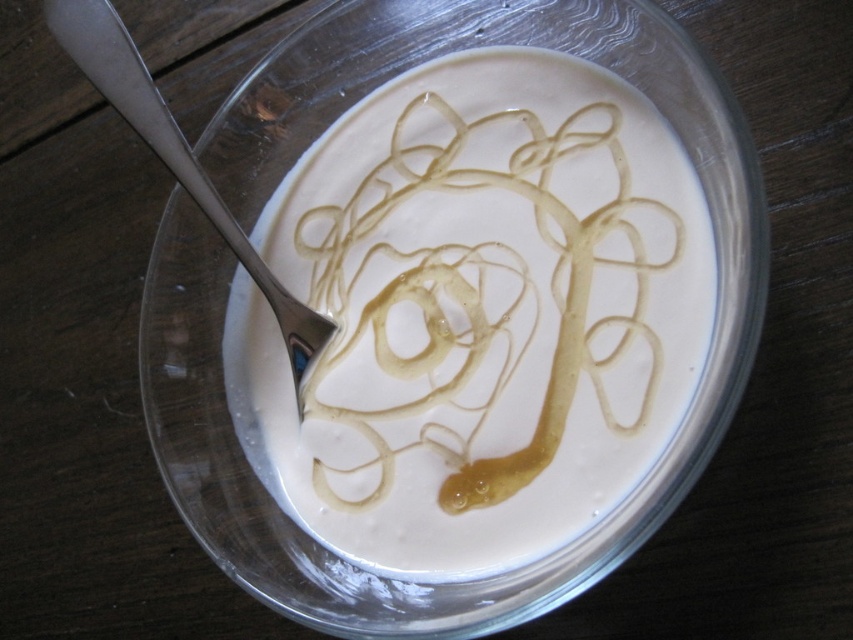
Can you confirm if transparent glass bowl at center is positioned to the left of silver metallic spoon at upper left?

No, transparent glass bowl at center is not to the left of silver metallic spoon at upper left.

Can you confirm if transparent glass bowl at center is positioned above silver metallic spoon at upper left?

No.

This screenshot has height=640, width=853. What do you see at coordinates (247, 284) in the screenshot? I see `transparent glass bowl at center` at bounding box center [247, 284].

Image resolution: width=853 pixels, height=640 pixels. What are the coordinates of `transparent glass bowl at center` in the screenshot? It's located at (x=247, y=284).